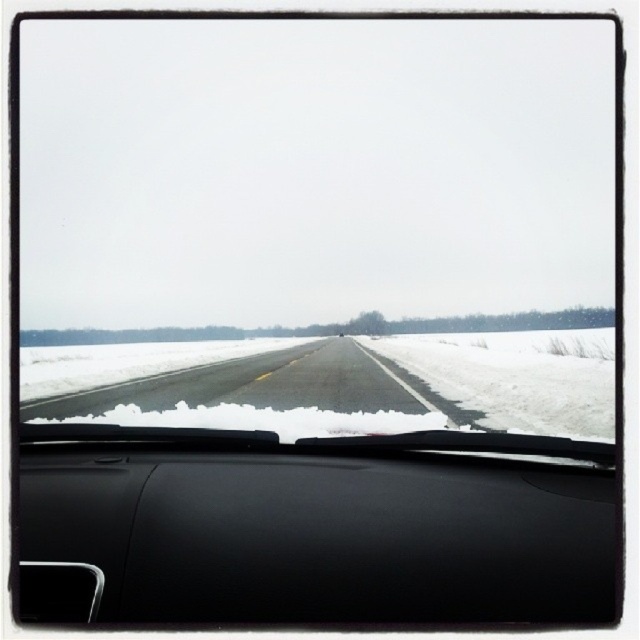
Does black matte dashboard at center have a larger size compared to black asphalt highway at center?

Incorrect, black matte dashboard at center is not larger than black asphalt highway at center.

Can you confirm if black matte dashboard at center is positioned to the left of black asphalt highway at center?

Incorrect, black matte dashboard at center is not on the left side of black asphalt highway at center.

The width and height of the screenshot is (640, 640). Describe the element at coordinates (324, 534) in the screenshot. I see `black matte dashboard at center` at that location.

The image size is (640, 640). What are the coordinates of `black matte dashboard at center` in the screenshot? It's located at (324, 534).